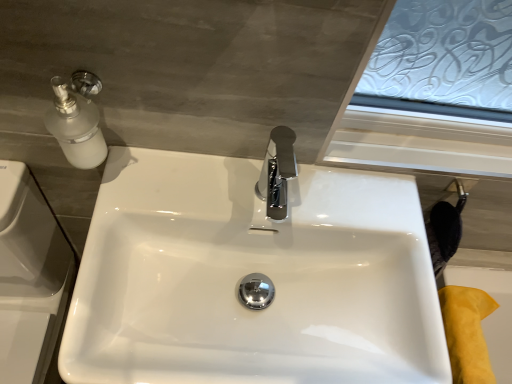
This screenshot has height=384, width=512. What do you see at coordinates (492, 313) in the screenshot? I see `yellow suede bath at lower right` at bounding box center [492, 313].

At what (x,y) coordinates should I click in order to perform the action: click on yellow suede bath at lower right. Please return your answer as a coordinate pair (x, y). The image size is (512, 384). Looking at the image, I should click on (492, 313).

What do you see at coordinates (250, 273) in the screenshot?
I see `white glossy sink at center` at bounding box center [250, 273].

Image resolution: width=512 pixels, height=384 pixels. Find the location of `white glossy sink at center`. white glossy sink at center is located at coordinates (250, 273).

Identify the location of yellow suede bath at lower right. (492, 313).

Is yellow suede bath at lower right to the left or to the right of white glossy sink at center in the image?

From the image, it's evident that yellow suede bath at lower right is to the right of white glossy sink at center.

Is yellow suede bath at lower right closer to the viewer compared to white glossy sink at center?

No, yellow suede bath at lower right is further to the viewer.

Which is in front, point (509, 300) or point (326, 186)?

The point (326, 186) is closer to the camera.

From the image's perspective, relative to white glossy sink at center, is yellow suede bath at lower right above or below?

Based on their image positions, yellow suede bath at lower right is located beneath white glossy sink at center.

From a real-world perspective, does yellow suede bath at lower right stand above white glossy sink at center?

Incorrect, from a real-world perspective, yellow suede bath at lower right is lower than white glossy sink at center.

Does yellow suede bath at lower right have a greater width compared to white glossy sink at center?

Incorrect, the width of yellow suede bath at lower right does not surpass that of white glossy sink at center.

Between yellow suede bath at lower right and white glossy sink at center, which one has less height?

yellow suede bath at lower right.

Considering the sizes of objects yellow suede bath at lower right and white glossy sink at center in the image provided, who is smaller, yellow suede bath at lower right or white glossy sink at center?

yellow suede bath at lower right.

Can white glossy sink at center be found inside yellow suede bath at lower right?

No.

Are yellow suede bath at lower right and white glossy sink at center making contact?

There is a gap between yellow suede bath at lower right and white glossy sink at center.

Does yellow suede bath at lower right turn towards white glossy sink at center?

No, yellow suede bath at lower right is not oriented towards white glossy sink at center.

Looking at this image, how far apart are yellow suede bath at lower right and white glossy sink at center?

The distance of yellow suede bath at lower right from white glossy sink at center is 21.63 inches.

What are the coordinates of `bath that appears below the white glossy sink at center (from the image's perspective)` in the screenshot? It's located at pyautogui.click(x=492, y=313).

Considering the relative positions of white glossy sink at center and yellow suede bath at lower right in the image provided, is white glossy sink at center to the left of yellow suede bath at lower right from the viewer's perspective?

Correct, you'll find white glossy sink at center to the left of yellow suede bath at lower right.

Considering the relative positions of white glossy sink at center and yellow suede bath at lower right in the image provided, is white glossy sink at center behind yellow suede bath at lower right?

No.

Consider the image. Which is closer to the camera, (210, 200) or (511, 379)?

Point (210, 200) is positioned closer to the camera compared to point (511, 379).

From the image's perspective, is white glossy sink at center below yellow suede bath at lower right?

No, from the image's perspective, white glossy sink at center is not below yellow suede bath at lower right.

From a real-world perspective, between white glossy sink at center and yellow suede bath at lower right, who is vertically lower?

From a 3D spatial view, yellow suede bath at lower right is below.

Does white glossy sink at center have a lesser width compared to yellow suede bath at lower right?

No, white glossy sink at center is not thinner than yellow suede bath at lower right.

Considering the relative sizes of white glossy sink at center and yellow suede bath at lower right in the image provided, is white glossy sink at center shorter than yellow suede bath at lower right?

In fact, white glossy sink at center may be taller than yellow suede bath at lower right.

Is white glossy sink at center bigger or smaller than yellow suede bath at lower right?

white glossy sink at center is bigger than yellow suede bath at lower right.

Is white glossy sink at center inside or outside of yellow suede bath at lower right?

The correct answer is: outside.

Are white glossy sink at center and yellow suede bath at lower right making contact?

white glossy sink at center is not next to yellow suede bath at lower right, and they're not touching.

Could you tell me if white glossy sink at center is facing yellow suede bath at lower right?

No, white glossy sink at center is not aimed at yellow suede bath at lower right.

Where is `sink in front of the yellow suede bath at lower right`? The width and height of the screenshot is (512, 384). sink in front of the yellow suede bath at lower right is located at coordinates (250, 273).

Find the location of `sink positioned vertically above the yellow suede bath at lower right (from a real-world perspective)`. sink positioned vertically above the yellow suede bath at lower right (from a real-world perspective) is located at coordinates (250, 273).

Find the location of a particular element. The height and width of the screenshot is (384, 512). bath below the white glossy sink at center (from the image's perspective) is located at coordinates (492, 313).